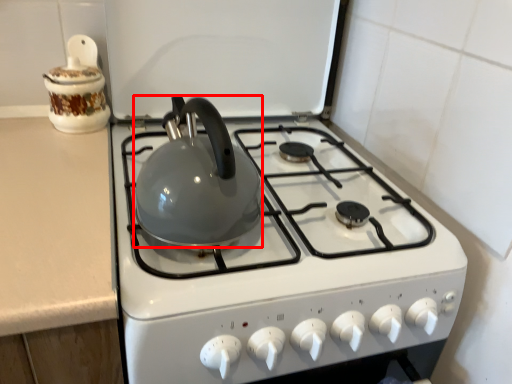
Question: Considering the relative positions of kettle (annotated by the red box) and kitchen appliance in the image provided, where is kettle (annotated by the red box) located with respect to the staircase?

Choices:
 (A) right
 (B) left

Answer: (A)